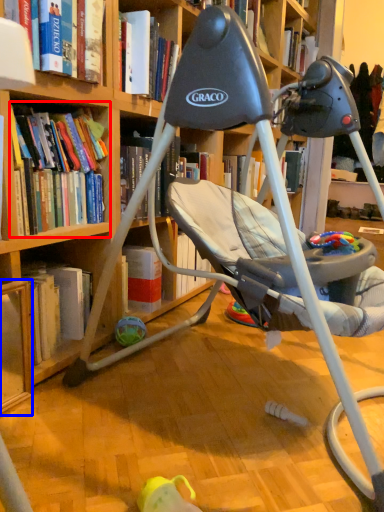
Question: Among these objects, which one is farthest to the camera, book (highlighted by a red box) or shelf (highlighted by a blue box)?

Choices:
 (A) book
 (B) shelf

Answer: (A)